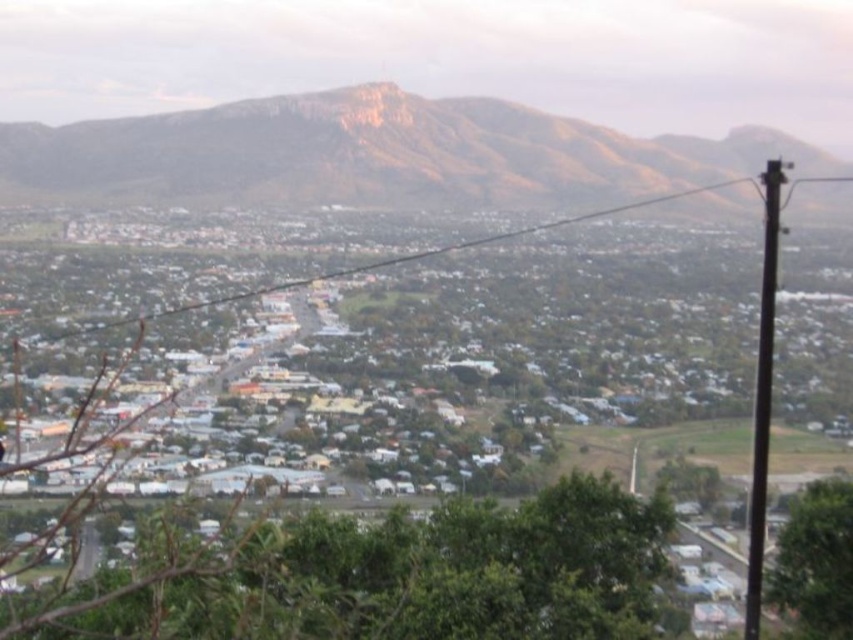
You are standing at the center of the town square and want to take a photo of the green leafy tree at center. In which direction should you point your camera to capture the tree in the frame?

The green leafy tree at center is located at coordinates point (381, 576), so you should point your camera towards the upper right direction to capture it.

You are standing at the center of the image and want to locate the green leafy tree at center. According to the coordinates provided, in which direction should you look to find it?

The green leafy tree at center is located at coordinates point (x=381, y=576), which means it is positioned to the right and slightly above the center of the image.